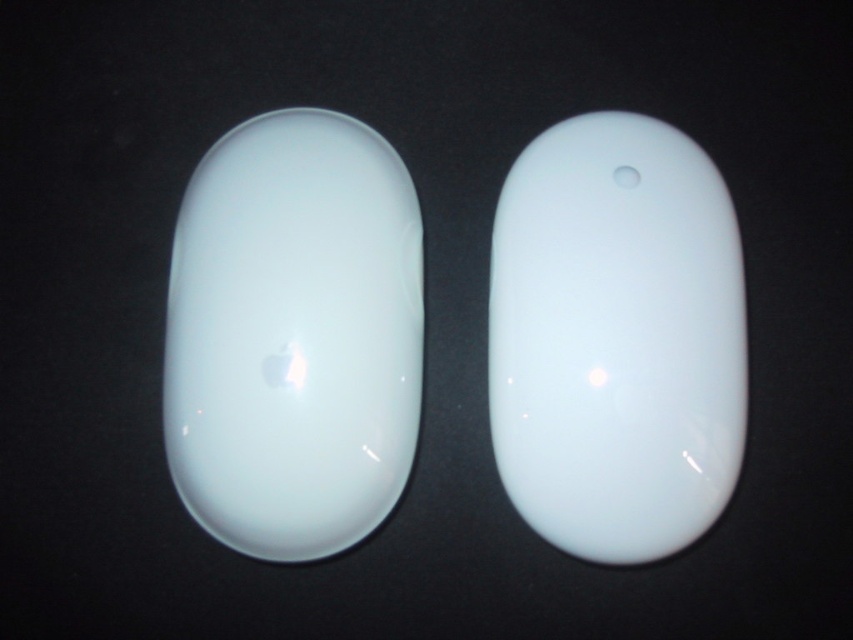
Question: Which point appears closest to the camera in this image?

Choices:
 (A) pos(726,467)
 (B) pos(169,369)

Answer: (A)

Question: Does glossy white mouse at left appear under glossy white mouse at center?

Choices:
 (A) yes
 (B) no

Answer: (B)

Question: Observing the image, what is the correct spatial positioning of glossy white mouse at left in reference to glossy white mouse at center?

Choices:
 (A) left
 (B) right

Answer: (A)

Question: Among these objects, which one is nearest to the camera?

Choices:
 (A) glossy white mouse at left
 (B) glossy white mouse at center

Answer: (B)

Question: In this image, where is glossy white mouse at left located relative to glossy white mouse at center?

Choices:
 (A) below
 (B) above

Answer: (B)